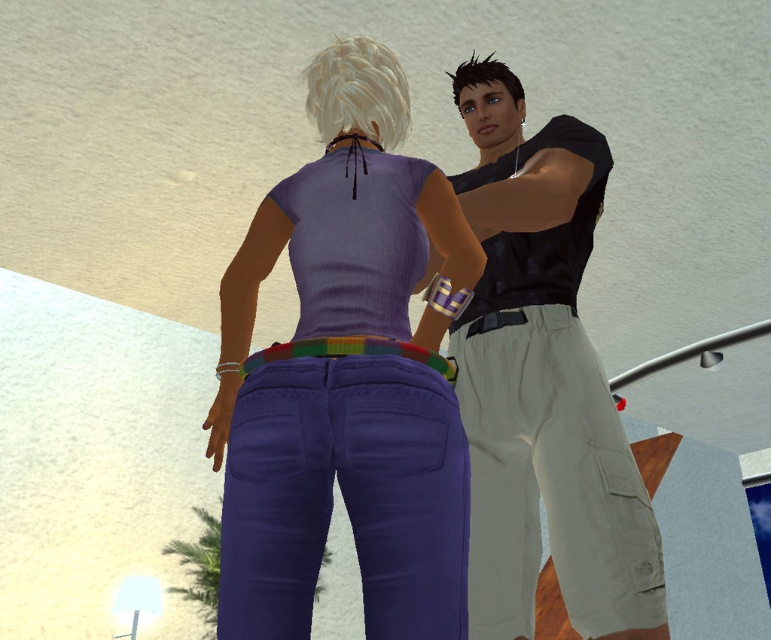
Question: Which object is the closest to the multicolored woven belt at center?

Choices:
 (A) purple matte jeans at center
 (B) black matte tank top at center

Answer: (A)

Question: Does purple matte jeans at center appear over black matte tank top at center?

Choices:
 (A) yes
 (B) no

Answer: (B)

Question: Which object is farther from the camera taking this photo?

Choices:
 (A) purple matte jeans at center
 (B) multicolored woven belt at center

Answer: (B)

Question: Among these objects, which one is nearest to the camera?

Choices:
 (A) black matte tank top at center
 (B) multicolored woven belt at center
 (C) purple matte jeans at center

Answer: (C)

Question: Does purple matte jeans at center have a lesser width compared to multicolored woven belt at center?

Choices:
 (A) no
 (B) yes

Answer: (A)

Question: Is black matte tank top at center below multicolored woven belt at center?

Choices:
 (A) no
 (B) yes

Answer: (A)